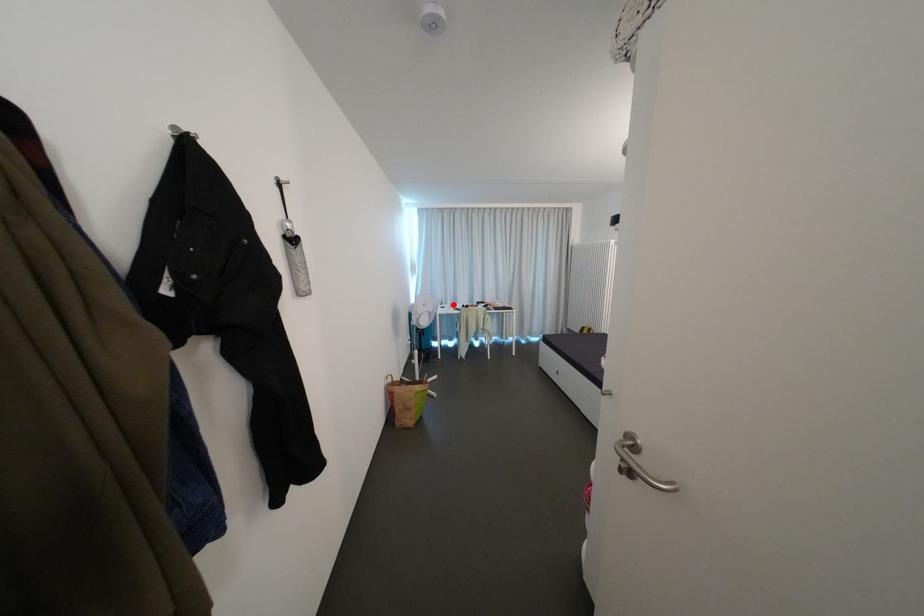
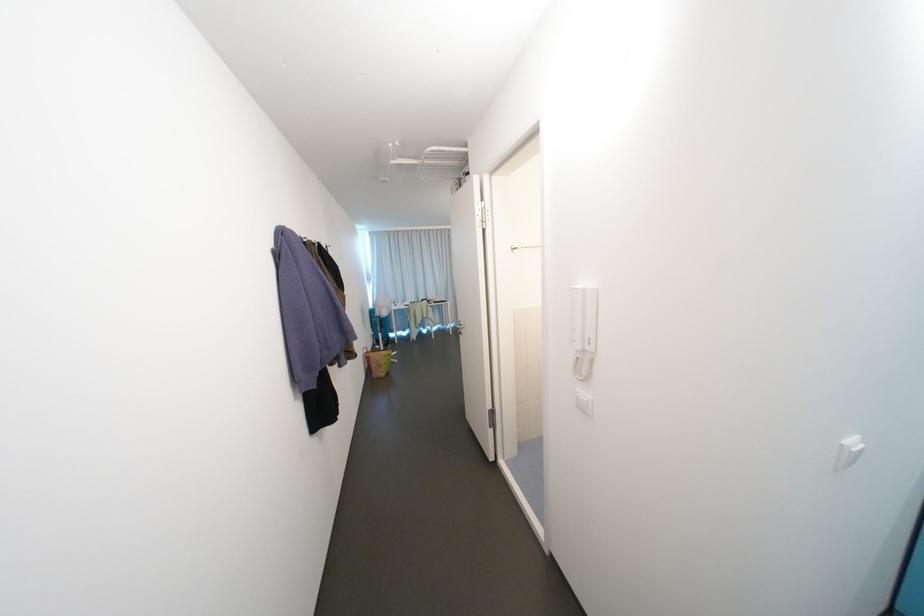
Where in the second image is the point corresponding to the highlighted location from the first image?

(406, 304)